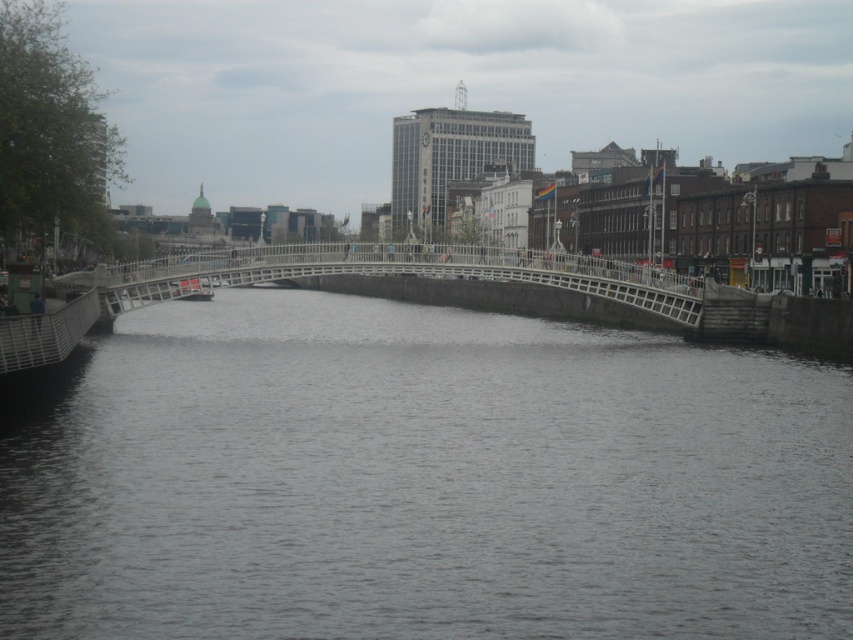
You are a photographer planning to capture the entire white metal bridge at center and metallic gray boat at center in a single frame. Given their sizes, which object should you position closer to the center of your camera frame to ensure both are fully visible?

The white metal bridge at center is larger in size than the metallic gray boat at center. To ensure both are fully visible in the frame, position the white metal bridge at center closer to the center of your camera frame.

You are a tourist standing on the riverside and want to take a photo of the white metal bridge at center and the metallic gray boat at center. Which object is located above the other in the image?

The white metal bridge at center is positioned over the metallic gray boat at center, so the bridge is above the boat in the image.